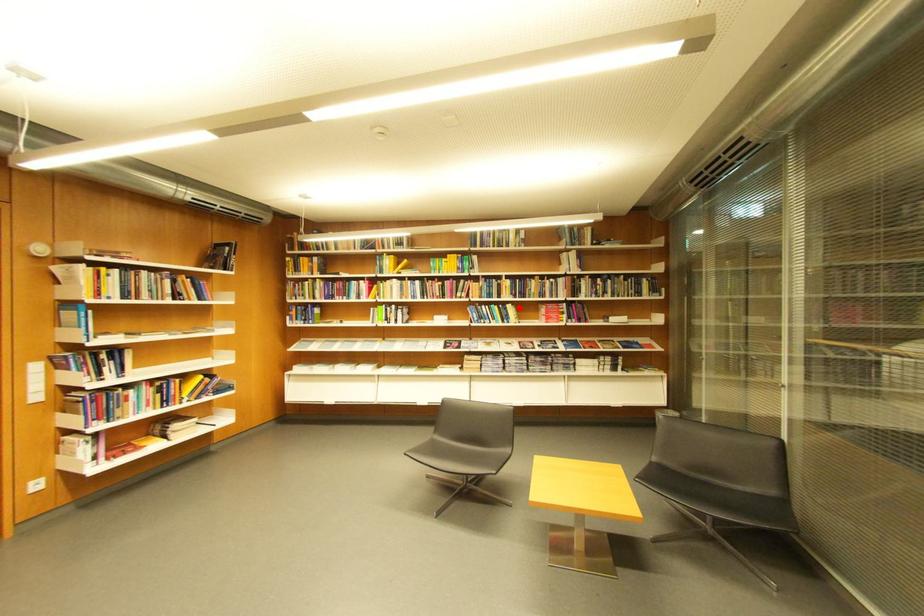
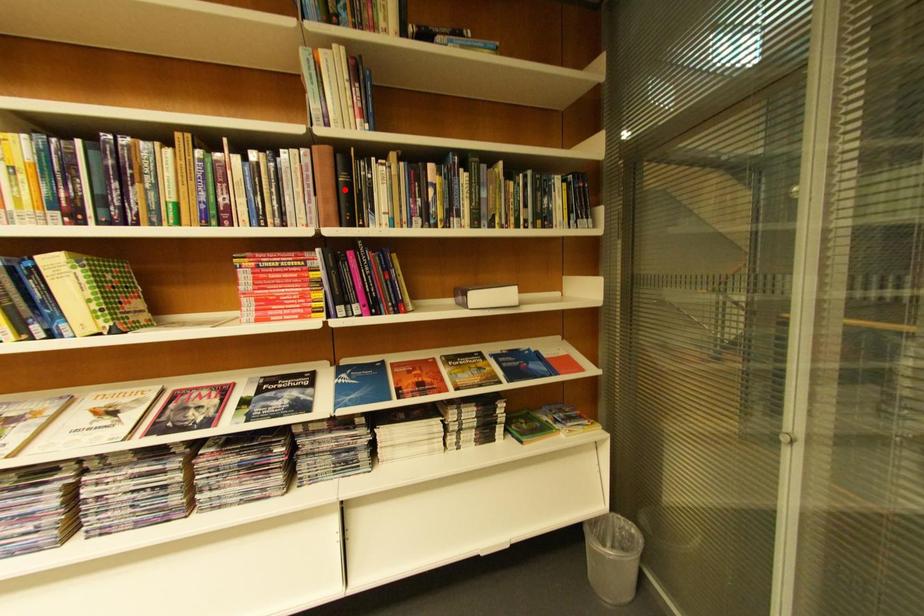
I am providing you with two images of the same scene from different viewpoints. A red point is marked on the first image and another point is marked on the second image. Does the point marked in image1 correspond to the same location as the one in image2?

No